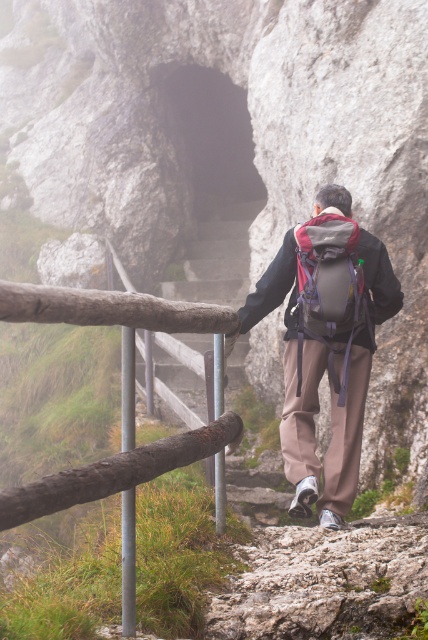
Question: Can you confirm if matte gray backpack at center is positioned to the left of gray fabric backpack at center?

Choices:
 (A) no
 (B) yes

Answer: (B)

Question: Which of the following is the closest to the observer?

Choices:
 (A) gray fabric backpack at center
 (B) matte gray backpack at center
 (C) brown wooden fence at left

Answer: (C)

Question: Which point is closer to the camera?

Choices:
 (A) matte gray backpack at center
 (B) brown wooden fence at left

Answer: (B)

Question: Can you confirm if matte gray backpack at center is bigger than brown wooden fence at left?

Choices:
 (A) yes
 (B) no

Answer: (A)

Question: Is brown wooden fence at left to the left of gray fabric backpack at center from the viewer's perspective?

Choices:
 (A) yes
 (B) no

Answer: (A)

Question: Which point is closer to the camera taking this photo?

Choices:
 (A) (360, 426)
 (B) (329, 262)

Answer: (B)